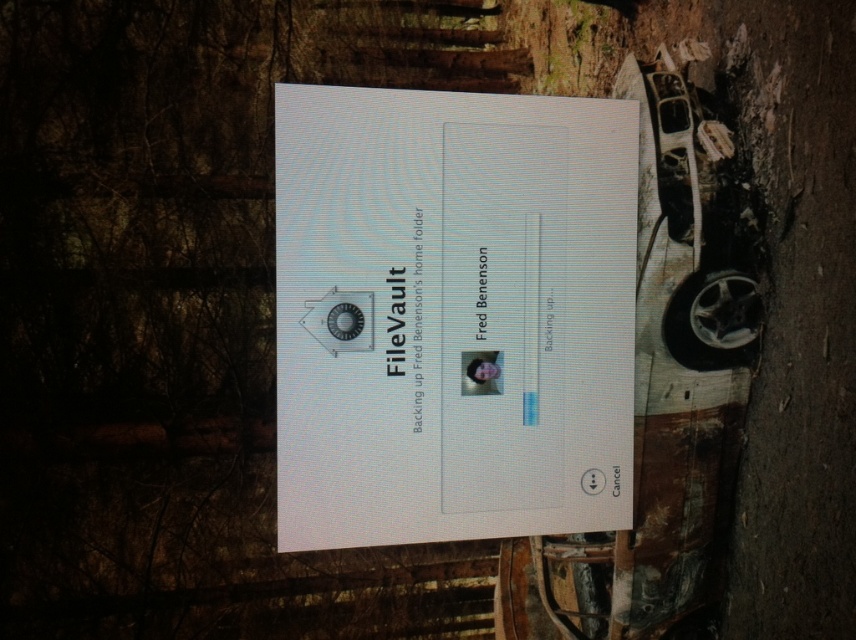
Question: Is the position of white glossy paper at center more distant than that of silver metallic car at right?

Choices:
 (A) yes
 (B) no

Answer: (B)

Question: Can you confirm if white glossy paper at center is positioned above silver metallic car at right?

Choices:
 (A) yes
 (B) no

Answer: (B)

Question: Can you confirm if white glossy paper at center is smaller than silver metallic car at right?

Choices:
 (A) no
 (B) yes

Answer: (A)